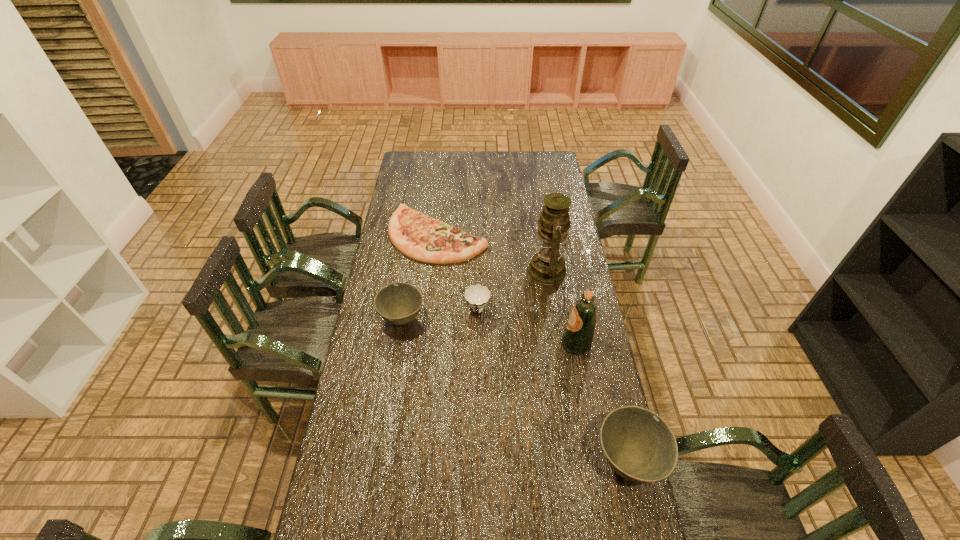
You are a GUI agent. You are given a task and a screenshot of the screen. Output one action in this format:
    pyautogui.click(x=<x>, y=<y>)
    Task: Click on the free space between the olive oil and the third tallest object
    This screenshot has width=960, height=540.
    Given the screenshot: What is the action you would take?
    pyautogui.click(x=602, y=402)

What are the coordinates of `vacant point located between the shortest object and the olive oil` in the screenshot? It's located at (507, 289).

This screenshot has height=540, width=960. I want to click on unoccupied position between the olive oil and the oil lamp, so click(563, 308).

Where is `vacant area that lies between the cup and the fourth shortest object`? vacant area that lies between the cup and the fourth shortest object is located at coordinates (553, 386).

Find the location of a particular element. The image size is (960, 540). free spot between the pizza and the shorter bowl is located at coordinates (420, 277).

This screenshot has width=960, height=540. What are the coordinates of `vacant area that lies between the cup and the olive oil` in the screenshot? It's located at click(x=527, y=327).

What are the coordinates of `free space between the shortest object and the fifth tallest object` in the screenshot? It's located at (458, 273).

Identify the location of vacant space that's between the third shortest object and the cup. Image resolution: width=960 pixels, height=540 pixels. (440, 315).

Locate an element on the screen. The width and height of the screenshot is (960, 540). free space between the fifth tallest object and the oil lamp is located at coordinates (514, 291).

Where is `object that is the nearest to the fifth shortest object`? Image resolution: width=960 pixels, height=540 pixels. object that is the nearest to the fifth shortest object is located at coordinates (547, 266).